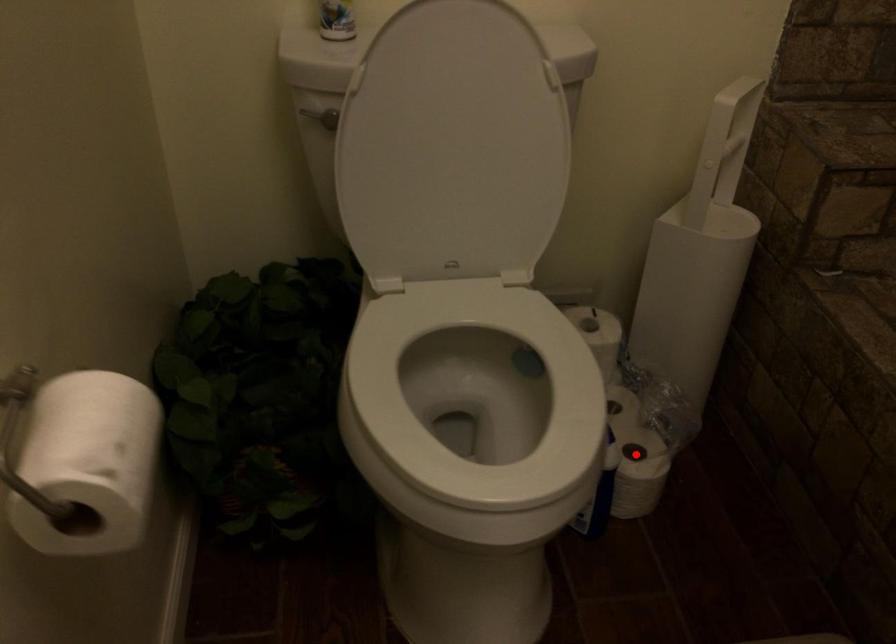
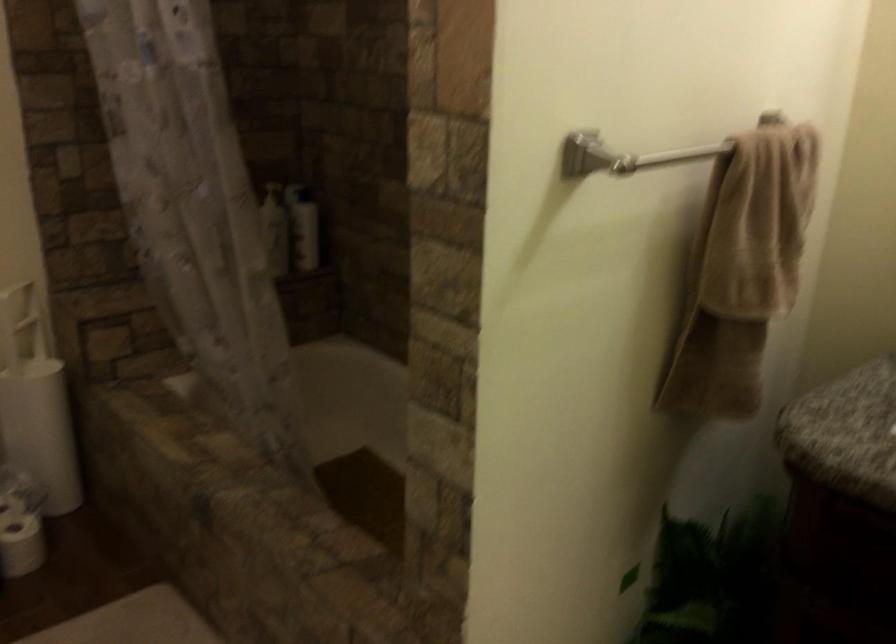
Question: I am providing you with two images of the same scene from different viewpoints. In image1, a red point is highlighted. Considering the same 3D point in image2, which of the following is correct?

Choices:
 (A) It is closer
 (B) It is farther

Answer: (B)